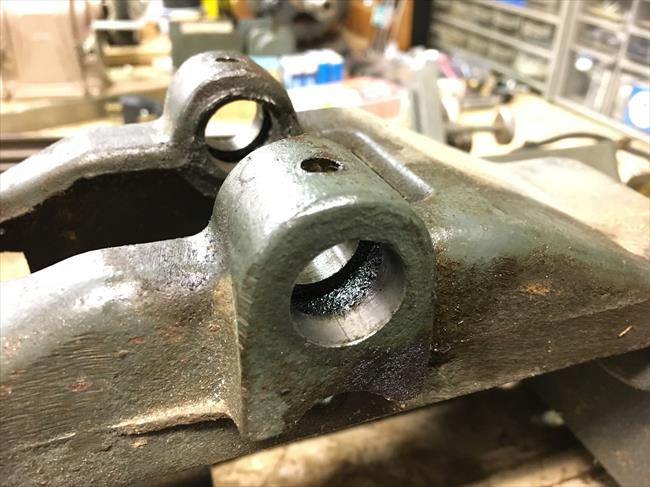
The width and height of the screenshot is (650, 487). What are the coordinates of `middle rack on shelf` in the screenshot? It's located at (441, 6), (459, 9), (480, 12), (497, 18), (535, 32), (595, 37), (641, 47).